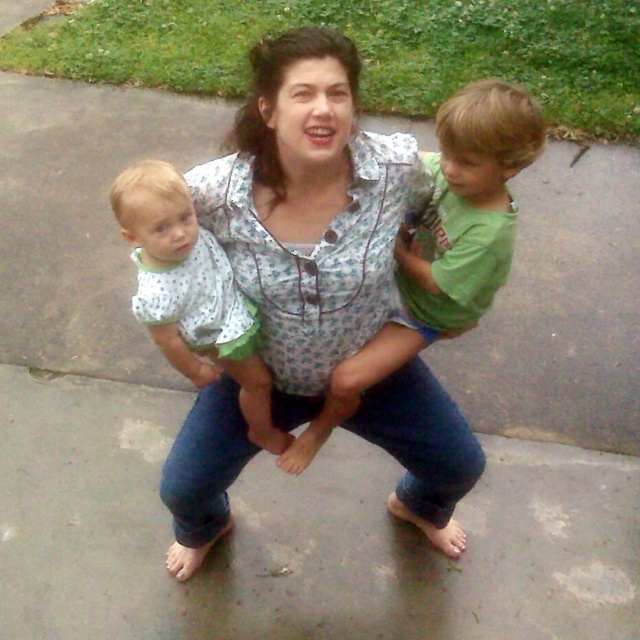
Who is positioned more to the left, floral shirt at center or green cotton shirt at upper center?

From the viewer's perspective, floral shirt at center appears more on the left side.

Is floral shirt at center shorter than green cotton shirt at upper center?

In fact, floral shirt at center may be taller than green cotton shirt at upper center.

What do you see at coordinates (308, 211) in the screenshot? I see `floral shirt at center` at bounding box center [308, 211].

In order to click on floral shirt at center in this screenshot , I will do `click(308, 211)`.

Which is in front, point (493, 80) or point (236, 308)?

Positioned in front is point (236, 308).

Can you confirm if green cotton shirt at upper center is bigger than polka dot fabric shirt at upper left?

Yes, green cotton shirt at upper center is bigger than polka dot fabric shirt at upper left.

Describe the element at coordinates (444, 244) in the screenshot. I see `green cotton shirt at upper center` at that location.

Identify the location of green cotton shirt at upper center. This screenshot has width=640, height=640. (444, 244).

Identify the location of floral shirt at center. Image resolution: width=640 pixels, height=640 pixels. (308, 211).

What do you see at coordinates (308, 211) in the screenshot? I see `floral shirt at center` at bounding box center [308, 211].

Between point (250, 100) and point (230, 278), which one is positioned in front?

Point (250, 100)

The image size is (640, 640). I want to click on floral shirt at center, so click(x=308, y=211).